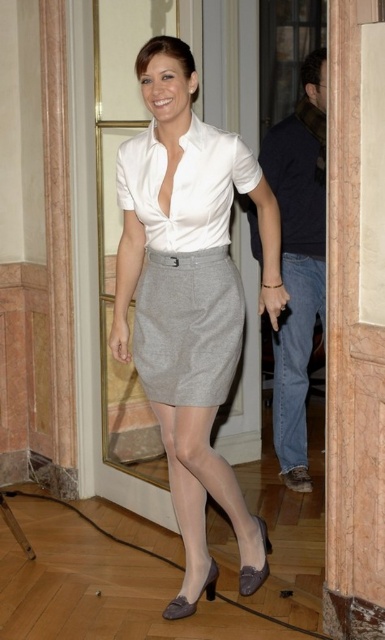
Between denim jeans at right and gray woolen skirt at center, which one is positioned lower?

gray woolen skirt at center is below.

Who is positioned more to the right, denim jeans at right or gray woolen skirt at center?

Positioned to the right is denim jeans at right.

Locate an element on the screen. denim jeans at right is located at coordinates (297, 260).

Looking at this image, does gray woolen skirt at center appear on the right side of matte gray heel at lower center?

No, gray woolen skirt at center is not to the right of matte gray heel at lower center.

Locate an element on the screen. This screenshot has height=640, width=385. gray woolen skirt at center is located at coordinates (187, 326).

Is white satin blouse at center behind matte gray heel at lower center?

No, white satin blouse at center is in front of matte gray heel at lower center.

Is white satin blouse at center taller than matte gray heel at lower center?

Yes.

Is point (187, 237) farther from camera compared to point (267, 538)?

No.

Find the location of a particular element. white satin blouse at center is located at coordinates (185, 186).